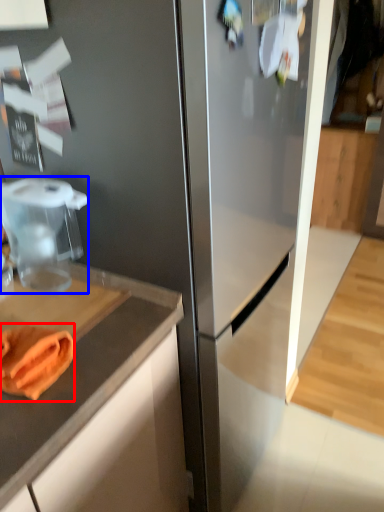
Question: Which object appears closest to the camera in this image, food (highlighted by a red box) or food processor (highlighted by a blue box)?

Choices:
 (A) food
 (B) food processor

Answer: (A)